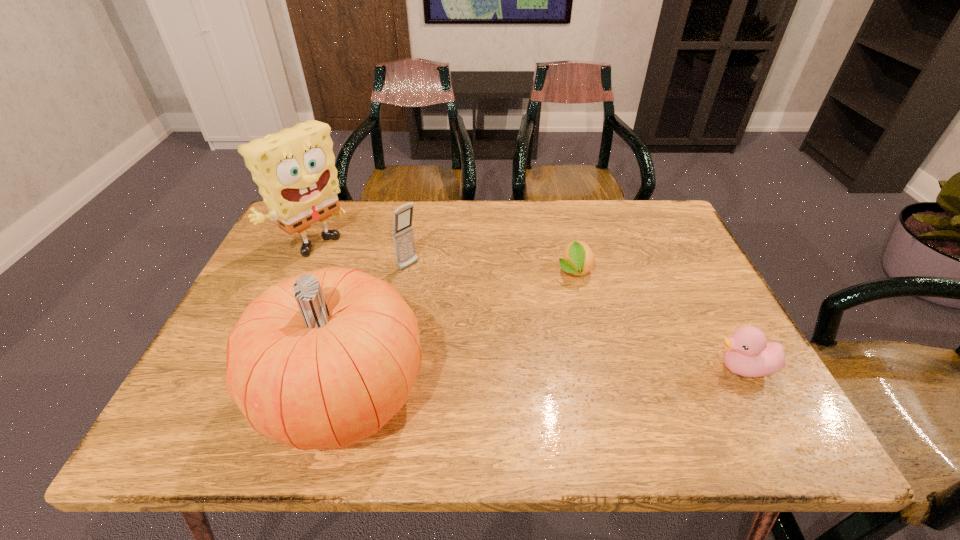
Locate an element on the screen. pumpkin is located at coordinates (323, 360).

Locate an element on the screen. This screenshot has width=960, height=540. duckling is located at coordinates (747, 353).

You are a GUI agent. You are given a task and a screenshot of the screen. Output one action in this format:
    pyautogui.click(x=<x>, y=<y>)
    Task: Click on the rightmost object
    
    Given the screenshot: What is the action you would take?
    pyautogui.click(x=747, y=353)

Locate an element on the screen. the third shortest object is located at coordinates (403, 236).

At what (x,y) coordinates should I click in order to perform the action: click on sponge. Please return your answer as a coordinate pair (x, y). Looking at the image, I should click on (295, 170).

I want to click on lemon, so click(x=578, y=259).

Where is `the shortest object`? This screenshot has width=960, height=540. the shortest object is located at coordinates coord(578,259).

Identify the location of vacant space located on the front-facing side of the pumpkin. (203, 394).

This screenshot has width=960, height=540. Identify the location of vacant space positioned on the front-facing side of the pumpkin. (223, 394).

At what (x,y) coordinates should I click in order to perform the action: click on free space located on the front-facing side of the pumpkin. Please return your answer as a coordinate pair (x, y). Looking at the image, I should click on (198, 394).